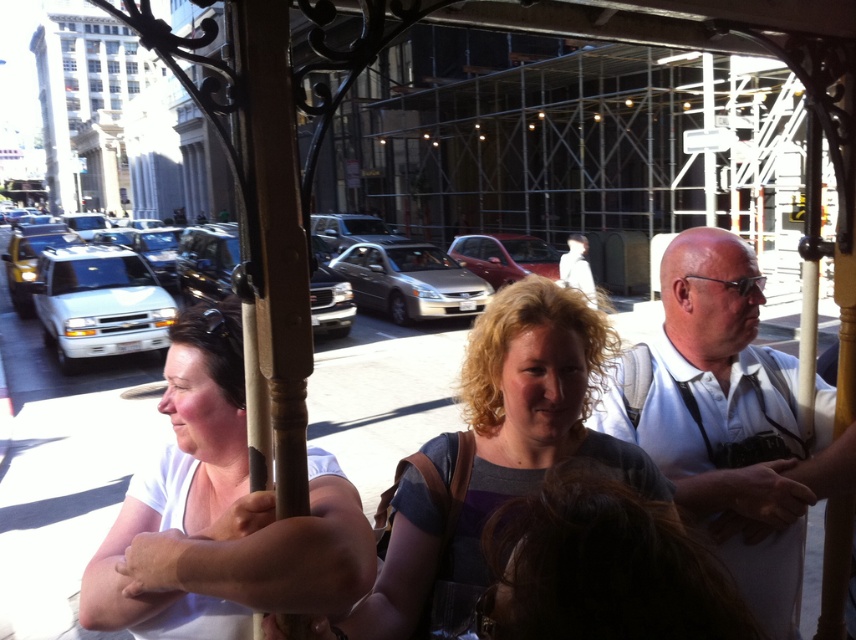
Can you confirm if white matte shirt at center is positioned to the right of matte gray shirt at center?

In fact, white matte shirt at center is to the left of matte gray shirt at center.

Which is behind, point (325, 573) or point (464, 506)?

Positioned behind is point (464, 506).

This screenshot has width=856, height=640. I want to click on white matte shirt at center, so [220, 515].

In order to click on white matte shirt at center in this screenshot , I will do `click(220, 515)`.

Is point (218, 422) positioned in front of point (834, 390)?

Yes, it is.

Does white matte shirt at center appear under white shirt at center?

Yes.

Who is more distant from viewer, (183, 458) or (698, 371)?

Point (698, 371)

The height and width of the screenshot is (640, 856). In order to click on white matte shirt at center in this screenshot , I will do `click(220, 515)`.

The image size is (856, 640). I want to click on white shirt at center, so click(x=732, y=422).

Is white shirt at center to the left of matte gray shirt at center from the viewer's perspective?

In fact, white shirt at center is to the right of matte gray shirt at center.

Is point (728, 403) more distant than point (504, 486)?

Yes, it is behind point (504, 486).

Where is `white shirt at center`? This screenshot has height=640, width=856. white shirt at center is located at coordinates (732, 422).